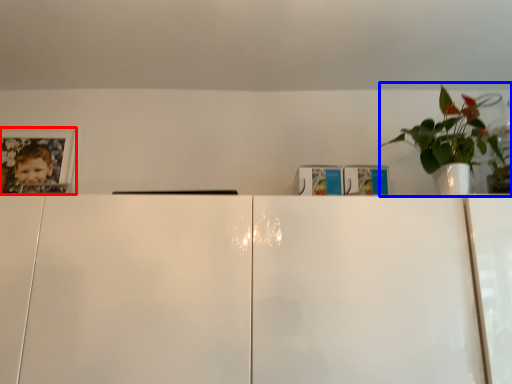
Question: Which of the following is the farthest to the observer, picture frame (highlighted by a red box) or houseplant (highlighted by a blue box)?

Choices:
 (A) picture frame
 (B) houseplant

Answer: (A)